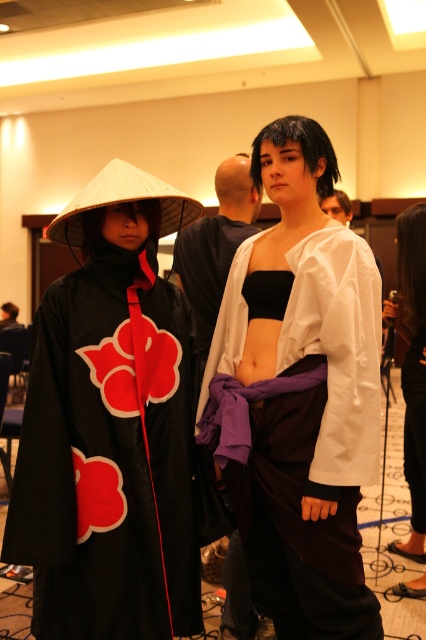
Does matte black kimono at center appear under matte black top at center?

No.

Is matte black kimono at center further to camera compared to matte black top at center?

Yes, matte black kimono at center is behind matte black top at center.

Where is `matte black kimono at center`? matte black kimono at center is located at coordinates (215, 244).

I want to click on matte black kimono at center, so click(215, 244).

Which is above, black matte kimono at left or white matte kimono at center?

Positioned higher is black matte kimono at left.

Is point (135, 291) less distant than point (319, 236)?

No, (135, 291) is further to viewer.

The width and height of the screenshot is (426, 640). What are the coordinates of `black matte kimono at left` in the screenshot? It's located at (111, 426).

Does black matte kimono at left appear on the left side of matte black pants at center?

Correct, you'll find black matte kimono at left to the left of matte black pants at center.

Can you confirm if black matte kimono at left is shorter than matte black pants at center?

Correct, black matte kimono at left is not as tall as matte black pants at center.

You are a GUI agent. You are given a task and a screenshot of the screen. Output one action in this format:
    pyautogui.click(x=<x>, y=<y>)
    Task: Click on the black matte kimono at left
    This screenshot has width=426, height=640.
    Given the screenshot: What is the action you would take?
    tap(111, 426)

At what (x,y) coordinates should I click in order to perform the action: click on black matte kimono at left. Please return your answer as a coordinate pair (x, y). The height and width of the screenshot is (640, 426). Looking at the image, I should click on [111, 426].